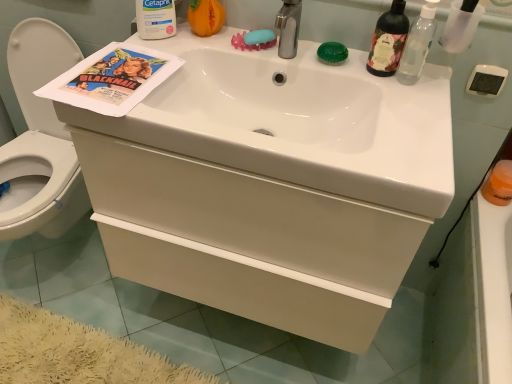
The height and width of the screenshot is (384, 512). I want to click on empty space that is to the right of white matte lotion at upper center, positioned as the 1th bottle in left-to-right order, so click(x=206, y=41).